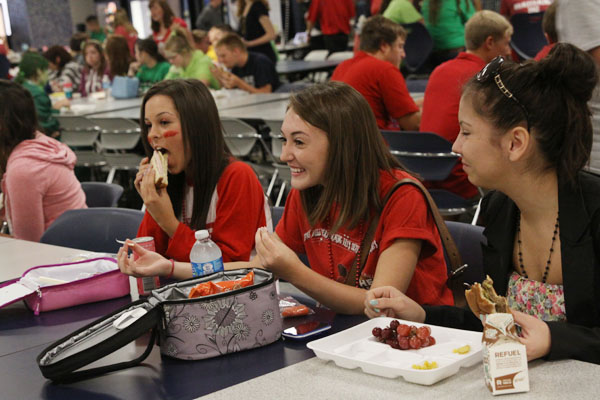
Find the location of a particular element. The height and width of the screenshot is (400, 600). table is located at coordinates (25, 262), (264, 110), (297, 62).